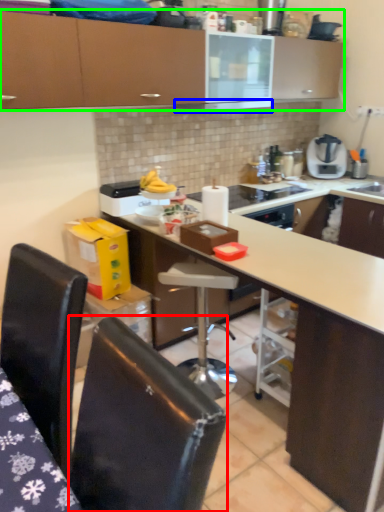
Question: Based on their relative distances, which object is farther from chair (highlighted by a red box)? Choose from exhaust hood (highlighted by a blue box) and cabinetry (highlighted by a green box).

Choices:
 (A) exhaust hood
 (B) cabinetry

Answer: (A)